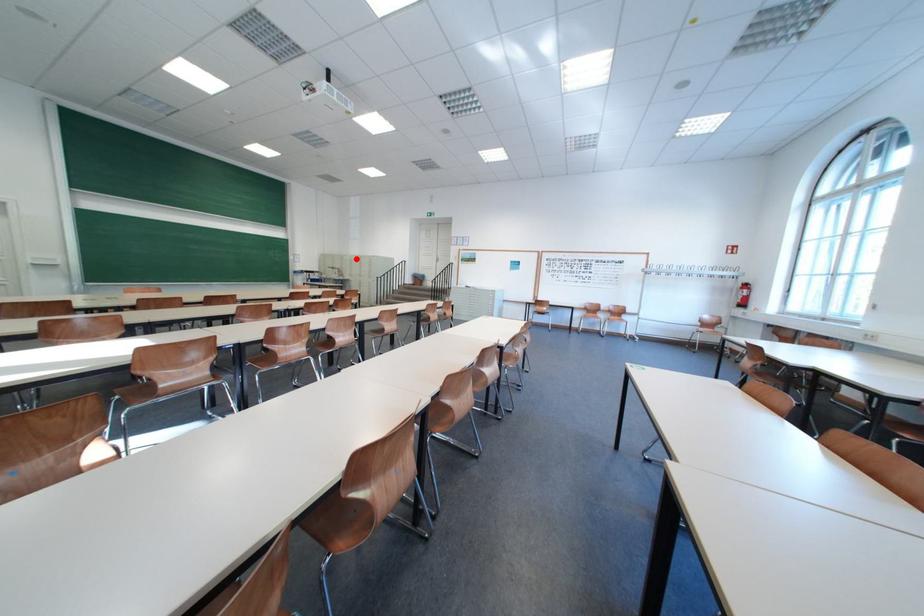
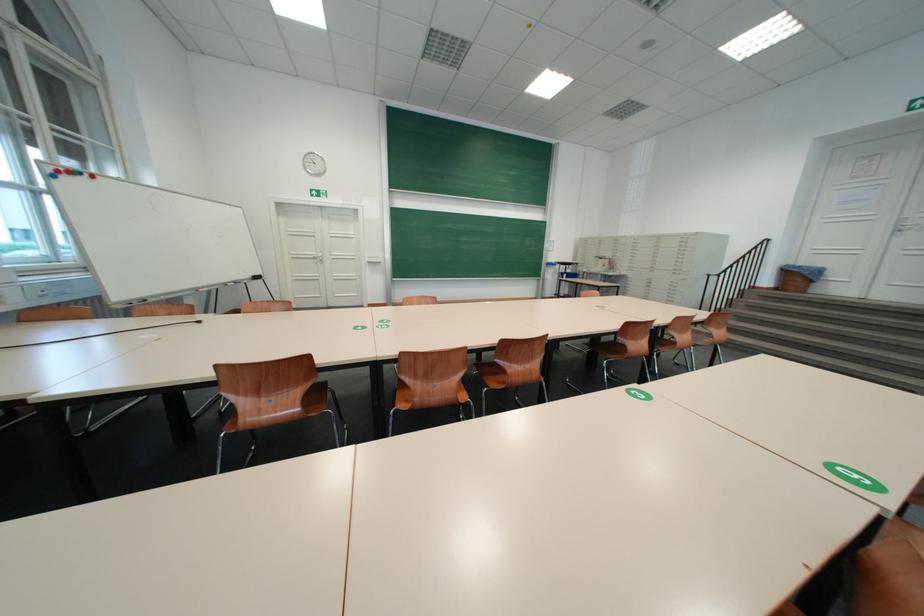
The point at the highlighted location is marked in the first image. Where is the corresponding point in the second image?

(630, 241)